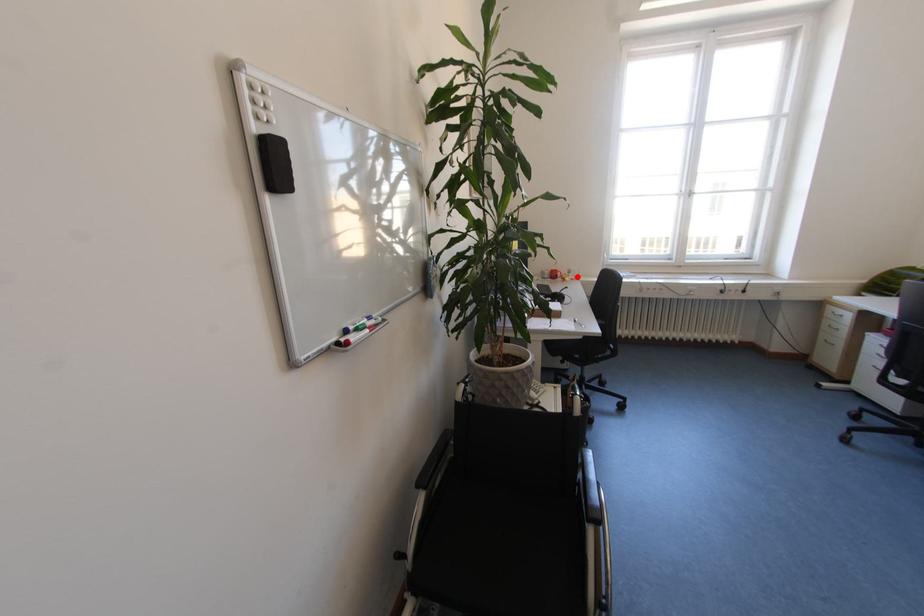
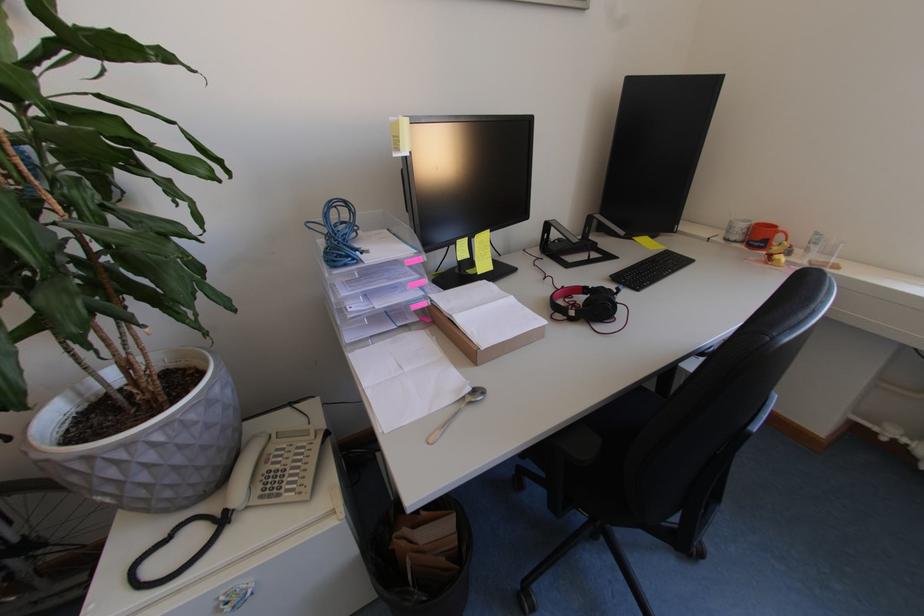
Question: I am providing you with two images of the same scene from different viewpoints. A red point is shown in image1. For the corresponding object point in image2, is it positioned nearer or farther from the camera?

Choices:
 (A) Nearer
 (B) Farther

Answer: (B)